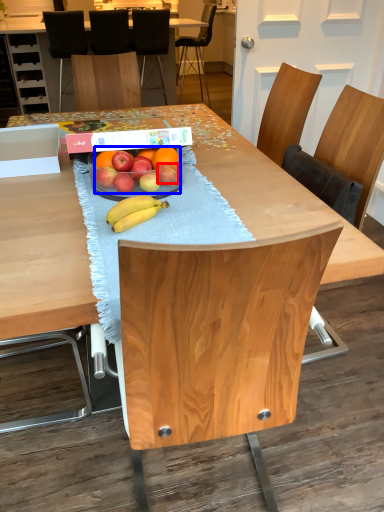
Question: Which object appears closest to the camera in this image, apple (highlighted by a red box) or grapefruit (highlighted by a blue box)?

Choices:
 (A) apple
 (B) grapefruit

Answer: (B)